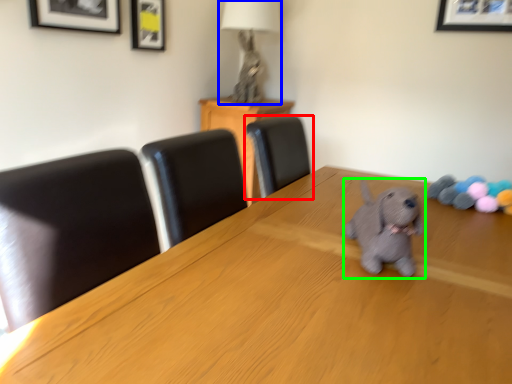
Question: Which object is positioned farthest from chair (highlighted by a red box)? Select from table lamp (highlighted by a blue box) and dog (highlighted by a green box).

Choices:
 (A) table lamp
 (B) dog

Answer: (A)